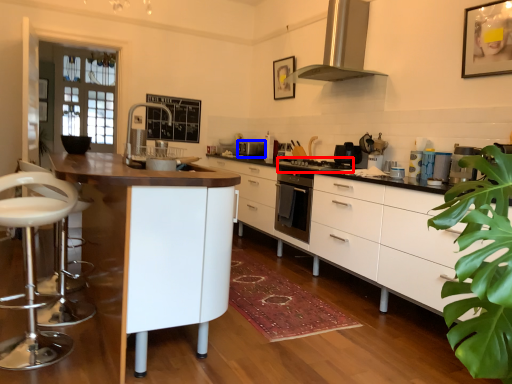
Question: Which point is closer to the camera, gas stove (highlighted by a red box) or appliance (highlighted by a blue box)?

Choices:
 (A) gas stove
 (B) appliance

Answer: (A)